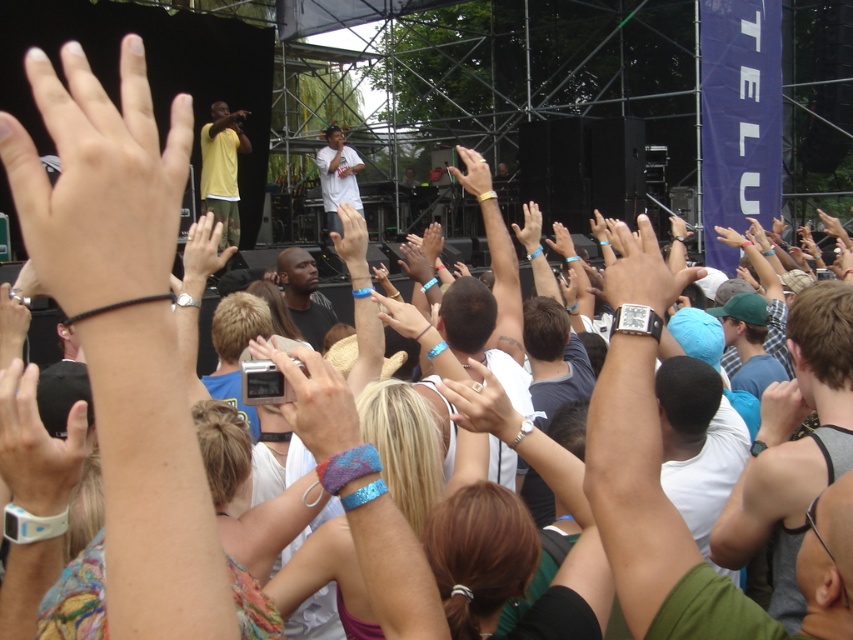
You are a photographer standing at the back of the concert venue. You want to take a clear photo of the smooth skin hand at center. What is the minimum focal length required to capture the hand without distortion?

The smooth skin hand at center is 3.28 meters away from the camera. To capture it clearly without distortion, the photographer should use a focal length of at least 50mm.

You are a photographer at the concert and want to take a photo of both the smooth skin hand at center and the matte black hand at center. Which hand should you focus on first if you need to capture them in order from closest to farthest from your camera?

The smooth skin hand at center is shorter than the matte black hand at center, so you should focus on the smooth skin hand at center first as it is closer to the camera.

You are a photographer at the concert. You need to capture a photo that includes both the smooth skin hand at center and the matte black hand at center. Based on their positions, which hand should you adjust your camera to focus on first to ensure both are in frame?

The smooth skin hand at center is to the left of the matte black hand at center, so you should focus on the matte black hand at center first to ensure both hands are included in the frame.